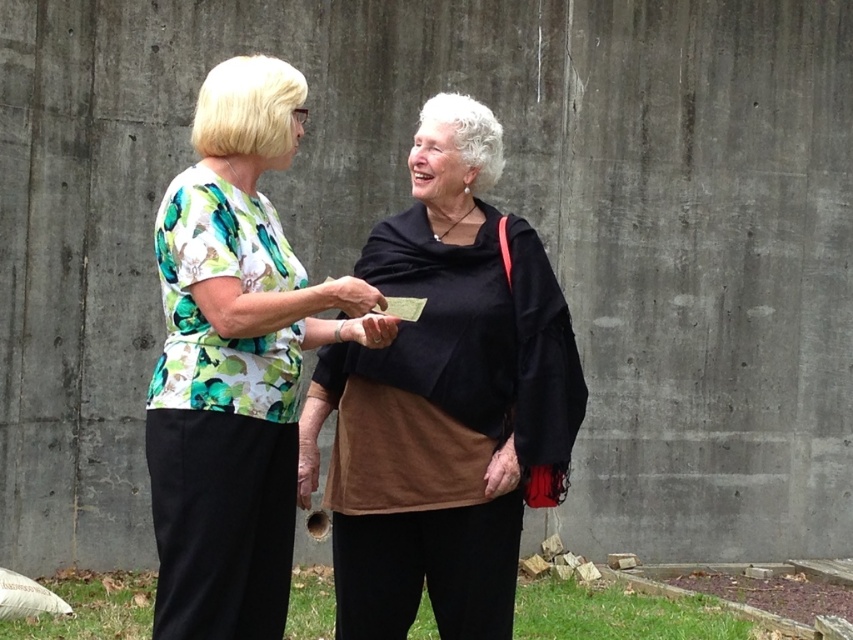
Can you confirm if printed fabric blouse at center is thinner than smooth skin hand at center?

No, printed fabric blouse at center is not thinner than smooth skin hand at center.

You are a GUI agent. You are given a task and a screenshot of the screen. Output one action in this format:
    pyautogui.click(x=<x>, y=<y>)
    Task: Click on the printed fabric blouse at center
    The image size is (853, 640).
    Given the screenshot: What is the action you would take?
    pyautogui.click(x=231, y=362)

Where is `printed fabric blouse at center`? The image size is (853, 640). printed fabric blouse at center is located at coordinates (231, 362).

Does point (538, 461) come in front of point (384, 296)?

Yes, point (538, 461) is in front of point (384, 296).

Who is more forward, (547,417) or (386,310)?

Point (386,310) is more forward.

The image size is (853, 640). I want to click on black suede shawl at center, so click(444, 401).

I want to click on black suede shawl at center, so click(444, 401).

The height and width of the screenshot is (640, 853). Identify the location of black suede shawl at center. pos(444,401).